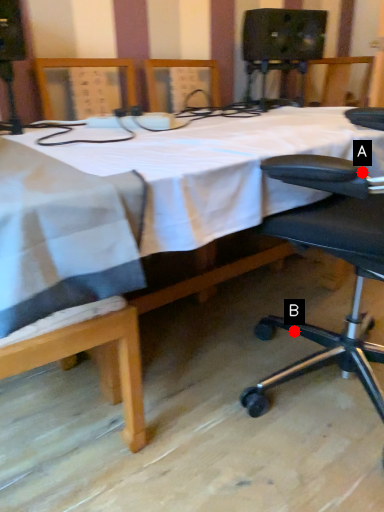
Question: Two points are circled on the image, labeled by A and B beside each circle. Among these points, which one is farthest from the camera?

Choices:
 (A) A is further
 (B) B is further

Answer: (B)